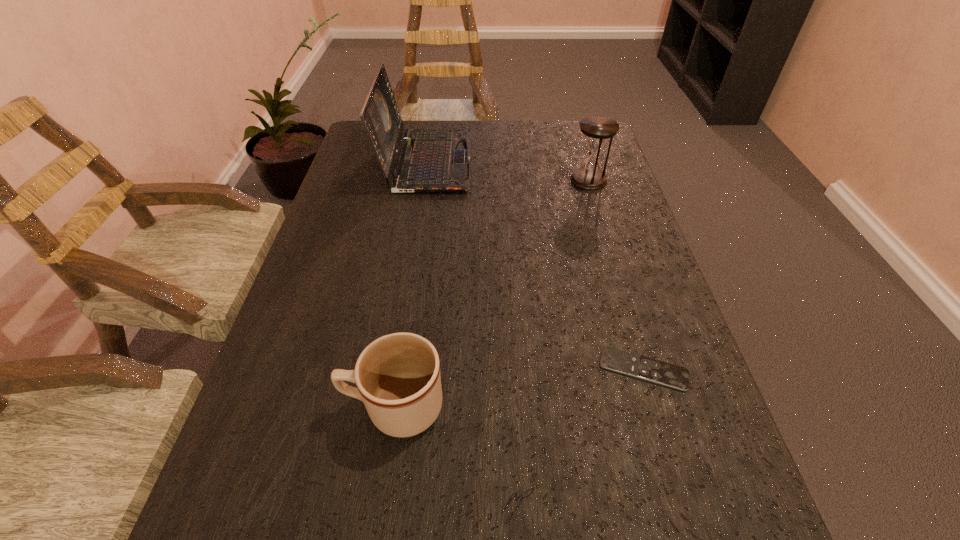
Find the location of `free space that satisfies the following two spatial constraints: 1. on the screen of the laptop computer; 2. on the side of the mug with the handle`. free space that satisfies the following two spatial constraints: 1. on the screen of the laptop computer; 2. on the side of the mug with the handle is located at coordinates (390, 407).

At what (x,y) coordinates should I click in order to perform the action: click on vacant point that satisfies the following two spatial constraints: 1. on the screen of the shortest object; 2. on the right side of the laptop computer. Please return your answer as a coordinate pair (x, y). The image size is (960, 540). Looking at the image, I should click on (396, 369).

At what (x,y) coordinates should I click in order to perform the action: click on vacant point that satisfies the following two spatial constraints: 1. on the side of the mug with the handle; 2. on the screen of the tallest object. Please return your answer as a coordinate pair (x, y). Looking at the image, I should click on (430, 161).

Find the location of `vacant space that satisfies the following two spatial constraints: 1. on the screen of the tallest object; 2. on the right side of the shortest object`. vacant space that satisfies the following two spatial constraints: 1. on the screen of the tallest object; 2. on the right side of the shortest object is located at coordinates (396, 369).

This screenshot has width=960, height=540. I want to click on vacant space that satisfies the following two spatial constraints: 1. on the screen of the tallest object; 2. on the side of the third tallest object with the handle, so click(x=390, y=407).

The height and width of the screenshot is (540, 960). I want to click on vacant space that satisfies the following two spatial constraints: 1. on the side of the second tallest object with the handle; 2. on the left side of the mug, so click(x=427, y=180).

Find the location of a particular element. This screenshot has height=540, width=960. free space that satisfies the following two spatial constraints: 1. on the side of the shortest object with the handle; 2. on the left side of the second shortest object is located at coordinates (400, 369).

Locate an element on the screen. The height and width of the screenshot is (540, 960). vacant space that satisfies the following two spatial constraints: 1. on the screen of the shortest object; 2. on the right side of the laptop computer is located at coordinates (396, 369).

Locate an element on the screen. The width and height of the screenshot is (960, 540). vacant space that satisfies the following two spatial constraints: 1. on the side of the mug with the handle; 2. on the screen of the tallest object is located at coordinates (430, 161).

Locate an element on the screen. Image resolution: width=960 pixels, height=540 pixels. free space that satisfies the following two spatial constraints: 1. on the screen of the laptop computer; 2. on the right side of the remote control is located at coordinates (396, 369).